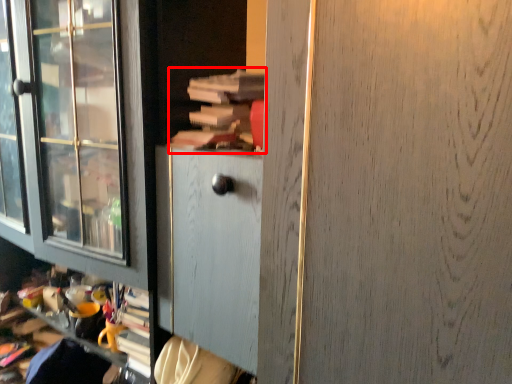
Question: Where is book (annotated by the red box) located in relation to screen door in the image?

Choices:
 (A) left
 (B) right

Answer: (A)